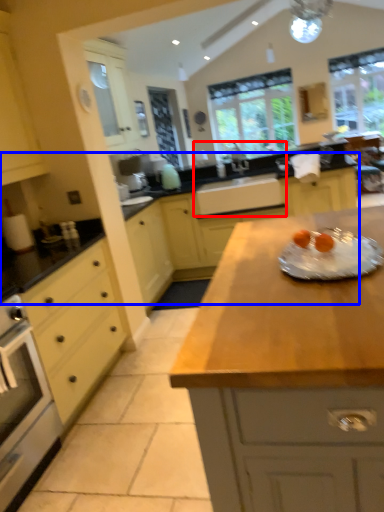
Question: Which object appears farthest to the camera in this image, sink (highlighted by a red box) or countertop (highlighted by a blue box)?

Choices:
 (A) sink
 (B) countertop

Answer: (A)